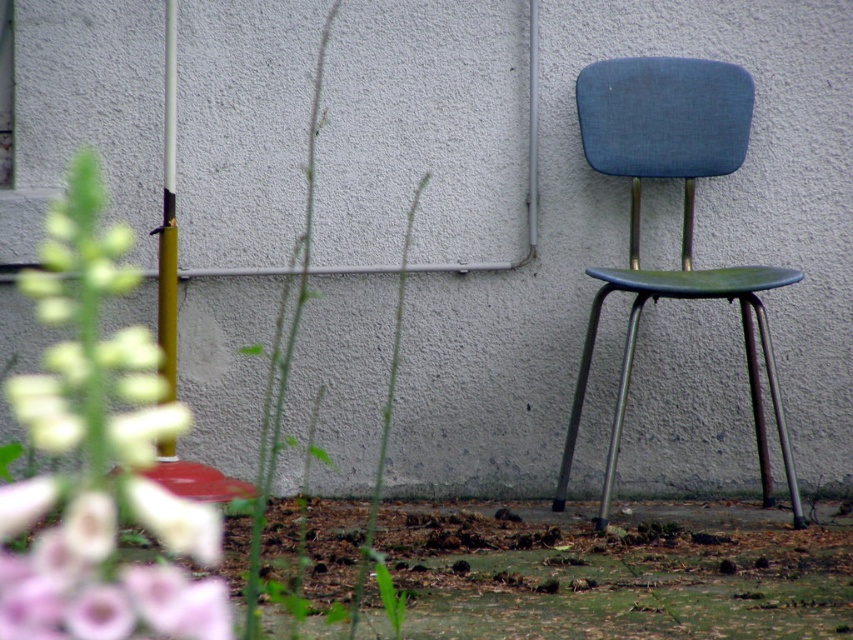
Is blue fabric chair at right bigger than green leafy stem at center?

Yes, blue fabric chair at right is bigger than green leafy stem at center.

What do you see at coordinates (682, 221) in the screenshot? The image size is (853, 640). I see `blue fabric chair at right` at bounding box center [682, 221].

Is point (706, 168) farther from camera compared to point (374, 506)?

No, (706, 168) is in front of (374, 506).

Find the location of a particular element. The width and height of the screenshot is (853, 640). blue fabric chair at right is located at coordinates 682,221.

Who is lower down, white fuzzy flowers at lower left or blue fabric chair at right?

white fuzzy flowers at lower left is below.

Does point (165, 596) come farther from viewer compared to point (666, 60)?

That is False.

Locate an element on the screen. The image size is (853, 640). white fuzzy flowers at lower left is located at coordinates 99,454.

The width and height of the screenshot is (853, 640). What do you see at coordinates (99, 454) in the screenshot?
I see `white fuzzy flowers at lower left` at bounding box center [99, 454].

Which of these two, white fuzzy flowers at lower left or green leafy stem at center, stands shorter?

green leafy stem at center

This screenshot has height=640, width=853. Describe the element at coordinates (99, 454) in the screenshot. I see `white fuzzy flowers at lower left` at that location.

Where is `white fuzzy flowers at lower left`? This screenshot has width=853, height=640. white fuzzy flowers at lower left is located at coordinates (99, 454).